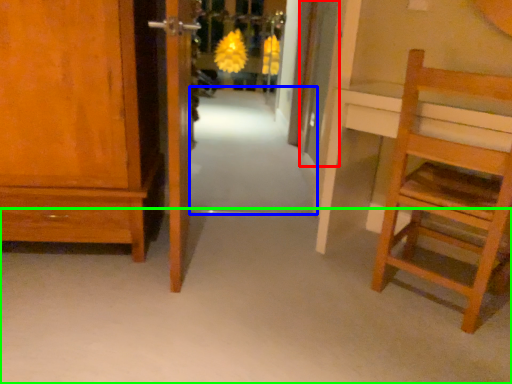
Question: Which is nearer to the door (highlighted by a red box)? path (highlighted by a blue box) or plain (highlighted by a green box).

Choices:
 (A) path
 (B) plain

Answer: (A)